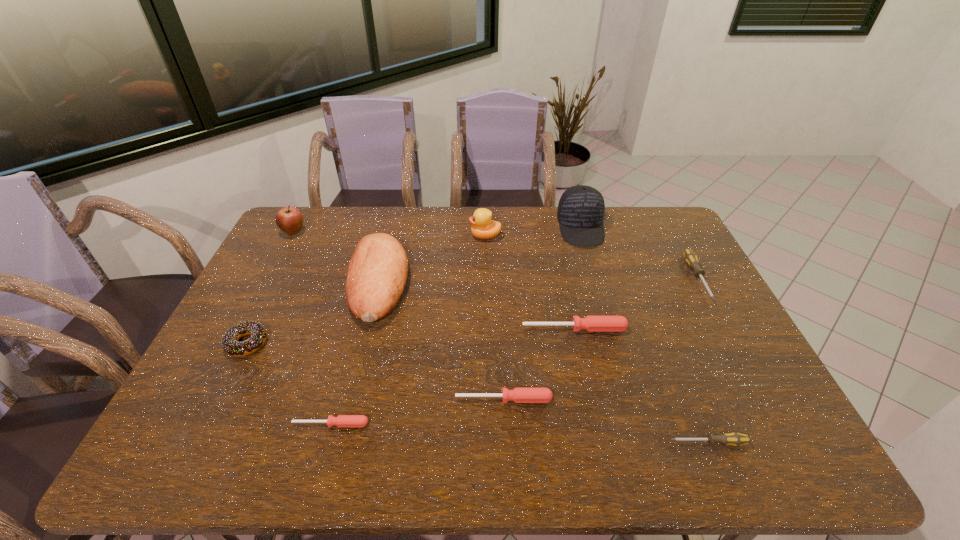
This screenshot has height=540, width=960. Find the location of `apple that is positioned at the far edge`. apple that is positioned at the far edge is located at coordinates (289, 219).

Where is `duckling positioned at the far edge`? duckling positioned at the far edge is located at coordinates (483, 227).

At what (x,y) coordinates should I click in order to perform the action: click on bread at the far edge. Please return your answer as a coordinate pair (x, y). The width and height of the screenshot is (960, 540). Looking at the image, I should click on (377, 272).

Locate an element on the screen. object positioned at the near edge is located at coordinates (736, 439).

At what (x,y) coordinates should I click in order to perform the action: click on apple situated at the left edge. Please return your answer as a coordinate pair (x, y). Looking at the image, I should click on (289, 219).

Where is `doughnut positioned at the left edge`? doughnut positioned at the left edge is located at coordinates (229, 343).

At what (x,y) coordinates should I click in order to perform the action: click on object that is at the far left corner. Please return your answer as a coordinate pair (x, y). This screenshot has width=960, height=540. Looking at the image, I should click on (289, 219).

I want to click on object that is at the near right corner, so click(736, 439).

Locate an element on the screen. Image resolution: width=960 pixels, height=540 pixels. vacant region at the far edge of the desktop is located at coordinates (543, 242).

In the image, there is a desktop. Identify the location of vacant space at the near edge. (465, 446).